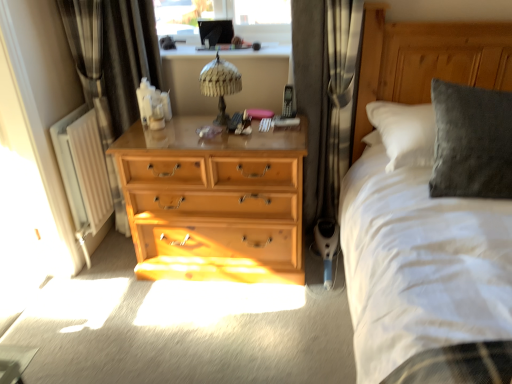
Question: Is light wood dresser at center bigger or smaller than woven fabric table lamp at center?

Choices:
 (A) big
 (B) small

Answer: (A)

Question: Is light wood dresser at center in front of or behind woven fabric table lamp at center in the image?

Choices:
 (A) front
 (B) behind

Answer: (A)

Question: Based on their relative distances, which object is nearer to the dark grey fabric curtain at center, marked as the 2th curtain in a left-to-right arrangement?

Choices:
 (A) black fabric curtain at left, placed as the first curtain when sorted from left to right
 (B) white painted metal radiator at left
 (C) light wood dresser at center
 (D) woven fabric table lamp at center

Answer: (D)

Question: Which of these objects is positioned farthest from the woven fabric table lamp at center?

Choices:
 (A) light wood dresser at center
 (B) white painted metal radiator at left
 (C) black fabric curtain at left, placed as the first curtain when sorted from left to right
 (D) dark grey fabric curtain at center, marked as the 2th curtain in a left-to-right arrangement

Answer: (B)